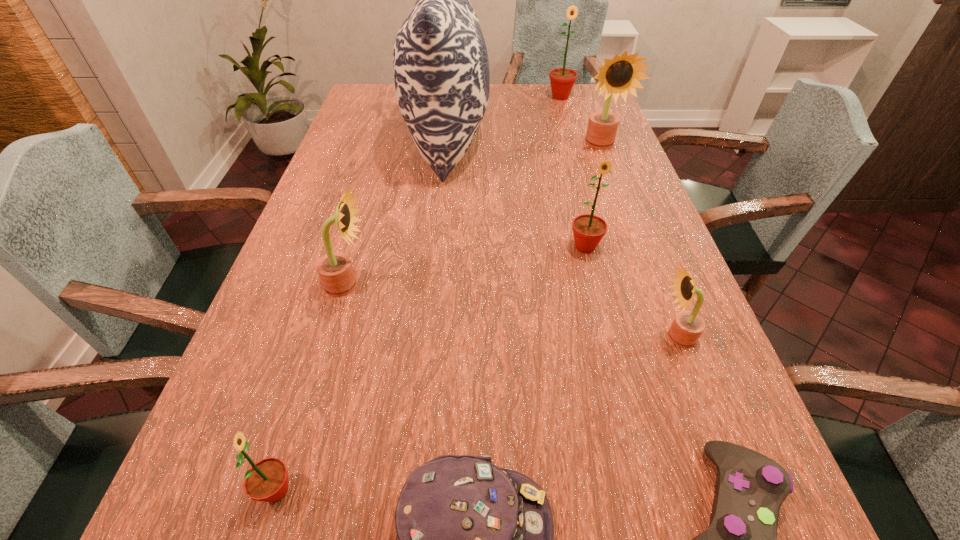
Identify the location of free space between the farthest yellow sunflower and the leftmost green sunflower. (439, 318).

Locate an element on the screen. This screenshot has height=540, width=960. free space between the third nearest sunflower and the biggest yellow sunflower is located at coordinates (474, 215).

Identify the location of vacant area between the second farthest green sunflower and the leftmost yellow sunflower. (467, 266).

Identify the location of vacant region between the smallest green sunflower and the second farthest sunflower. Image resolution: width=960 pixels, height=540 pixels. (439, 318).

At what (x,y) coordinates should I click in order to perform the action: click on unoccupied position between the fifth farthest object and the tallest object. Please return your answer as a coordinate pair (x, y). This screenshot has width=960, height=540. Looking at the image, I should click on (397, 214).

Identify the location of free area in between the sixth nearest object and the leftmost green sunflower. (431, 369).

You are a GUI agent. You are given a task and a screenshot of the screen. Output one action in this format:
    pyautogui.click(x=<x>, y=<y>)
    Task: Click on the unoccupied area between the nearest green sunflower and the fourth farthest object
    The image size is (960, 540).
    Given the screenshot: What is the action you would take?
    pyautogui.click(x=431, y=369)

Locate which object ranks seventh in proximity to the shortest object. Please provide its 2D coordinates. Your answer should be formatted as a tuple, i.e. [(x, y)], where the tuple contains the x and y coordinates of a point satisfying the conditions above.

[(620, 75)]

Where is `object that is the fifth closest to the farthest sunflower`? The height and width of the screenshot is (540, 960). object that is the fifth closest to the farthest sunflower is located at coordinates (687, 327).

Where is `sunflower that is the second closest one to the fourth nearest sunflower`? This screenshot has height=540, width=960. sunflower that is the second closest one to the fourth nearest sunflower is located at coordinates (620, 75).